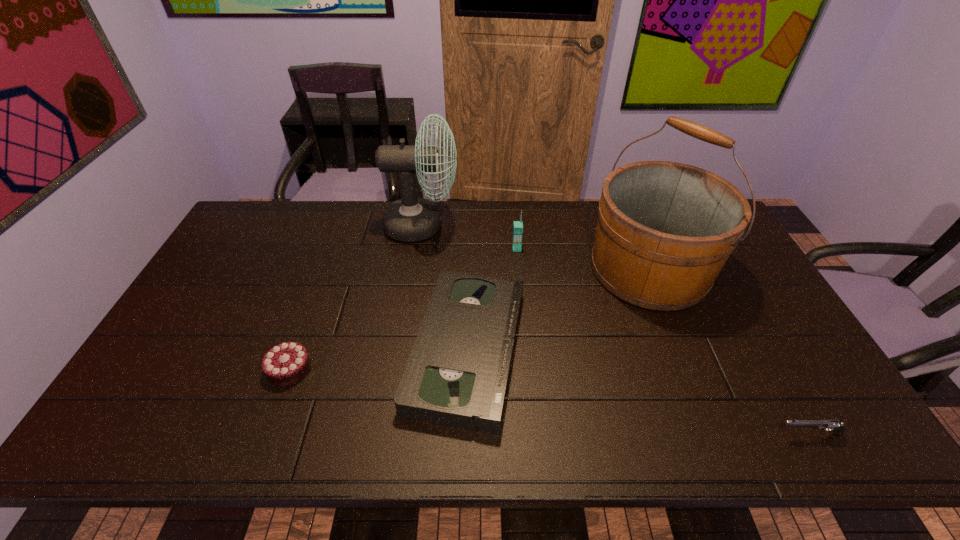
The height and width of the screenshot is (540, 960). I want to click on bucket, so click(665, 230).

This screenshot has height=540, width=960. Find the location of `the second tallest object`. the second tallest object is located at coordinates (410, 219).

Find the location of `the third tallest object`. the third tallest object is located at coordinates pyautogui.click(x=517, y=225).

Where is `the leftmost object`? This screenshot has width=960, height=540. the leftmost object is located at coordinates (285, 364).

This screenshot has height=540, width=960. In order to click on videotape in this screenshot , I will do `click(457, 374)`.

Identify the location of pistol. This screenshot has width=960, height=540. (837, 427).

Where is `vacant space located on the back of the bucket`? vacant space located on the back of the bucket is located at coordinates (631, 222).

Identify the location of free space located in front of the second tallest object where the airflow is directed. coord(547,226).

Where is `free space located on the keypad of the cellular telephone`? This screenshot has height=540, width=960. free space located on the keypad of the cellular telephone is located at coordinates (524, 328).

Image resolution: width=960 pixels, height=540 pixels. I want to click on vacant space situated on the front of the leftmost object, so click(276, 406).